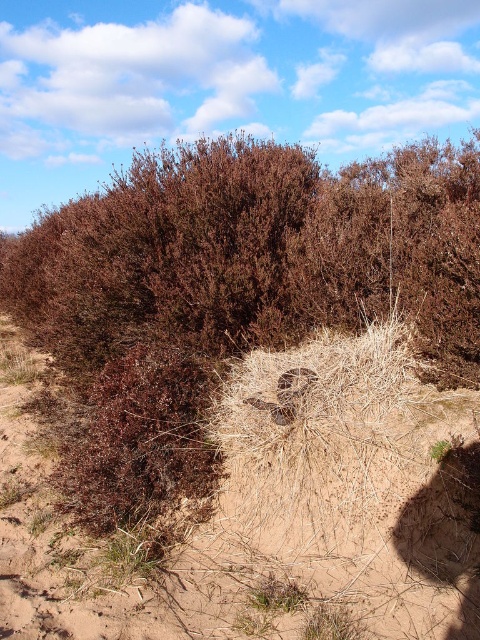
Based on the photo, you are a hiker who has spotted a brown dry bush at center and a dry straw nest at center in the landscape. Which object is located higher in the image?

The brown dry bush at center is positioned over the dry straw nest at center, so it is higher in the image.

You are a small animal trying to reach the dry straw nest at center from the brown dry bush at center. Can you make the jump if your maximum jumping distance is 2 meters?

The distance between the brown dry bush at center and dry straw nest at center is 2.51 meters, which exceeds your maximum jumping distance of 2 meters. Therefore, you cannot make the jump.

You are a bird flying over the sandy ground with brown dry bush at center and dry straw nest at center. Which object is closer to you as you fly above?

The brown dry bush at center is closer to you because it is further to the viewer than the dry straw nest at center, meaning it appears nearer in the visual perspective.